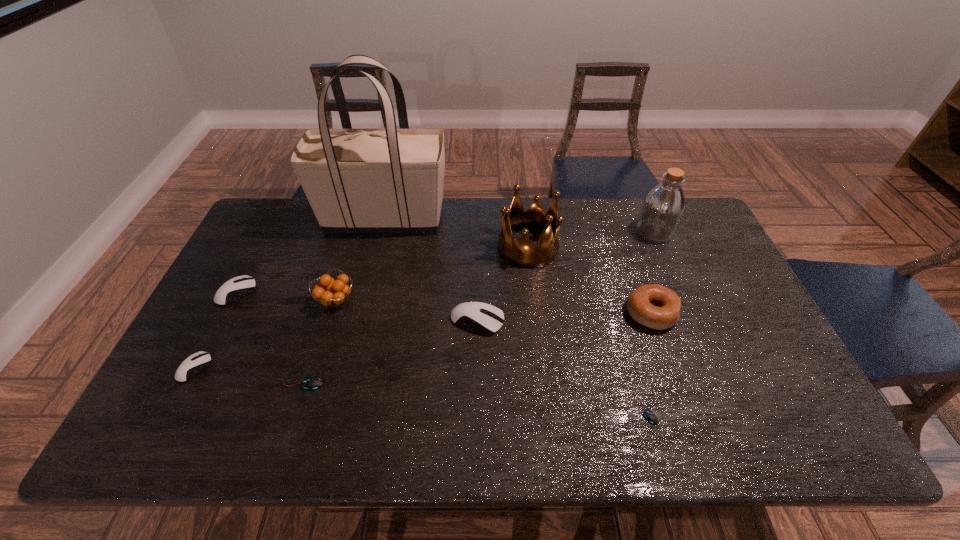
This screenshot has height=540, width=960. I want to click on mouse that is the fourth closest one to the farther black mouse, so click(x=650, y=416).

Locate which white mouse is the second closest to the second tallest object. Please provide its 2D coordinates. Your answer should be formatted as a tuple, i.e. [(x, y)], where the tuple contains the x and y coordinates of a point satisfying the conditions above.

[(240, 286)]

Find the location of `white mouse that is the nearest to the eighth shortest object`. white mouse that is the nearest to the eighth shortest object is located at coordinates [484, 318].

This screenshot has width=960, height=540. What are the coordinates of `vacant space that satisfies the following two spatial constraints: 1. on the front side of the sixth shortest object; 2. on the right side of the third tallest object` in the screenshot? It's located at (536, 313).

Locate an element on the screen. free region that satisfies the following two spatial constraints: 1. with handles facing forward on the tallest mouse; 2. on the right side of the tallest object is located at coordinates (360, 321).

This screenshot has width=960, height=540. Identify the location of free space in the image that satisfies the following two spatial constraints: 1. on the back side of the second farthest mouse; 2. with handles facing forward on the shopping bag. (478, 219).

Find the location of a particular element. The image size is (960, 540). free location that satisfies the following two spatial constraints: 1. with handles facing forward on the crown; 2. on the right side of the shopping bag is located at coordinates (377, 247).